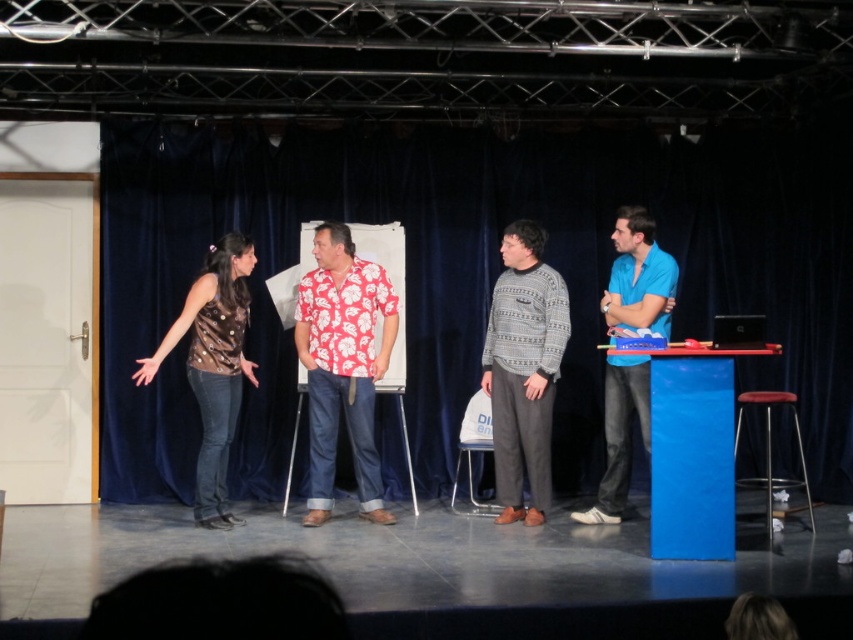
Is brown shiny tank top at left above clear plastic stool at center?

Yes.

Between brown shiny tank top at left and clear plastic stool at center, which one has more height?

brown shiny tank top at left

At what (x,y) coordinates should I click in order to perform the action: click on brown shiny tank top at left. Please return your answer as a coordinate pair (x, y). Looking at the image, I should click on (213, 365).

Does blue plastic podium at right have a smaller size compared to clear plastic stool at center?

Incorrect, blue plastic podium at right is not smaller in size than clear plastic stool at center.

Does point (727, 492) lie in front of point (489, 444)?

Yes, it is.

Where is `blue plastic podium at right`? The width and height of the screenshot is (853, 640). blue plastic podium at right is located at coordinates (693, 451).

Is floral print shirt at center smaller than blue plastic podium at right?

Incorrect, floral print shirt at center is not smaller in size than blue plastic podium at right.

Is point (349, 305) positioned behind point (676, 445)?

Yes, it is.

Locate an element on the screen. The width and height of the screenshot is (853, 640). floral print shirt at center is located at coordinates (343, 365).